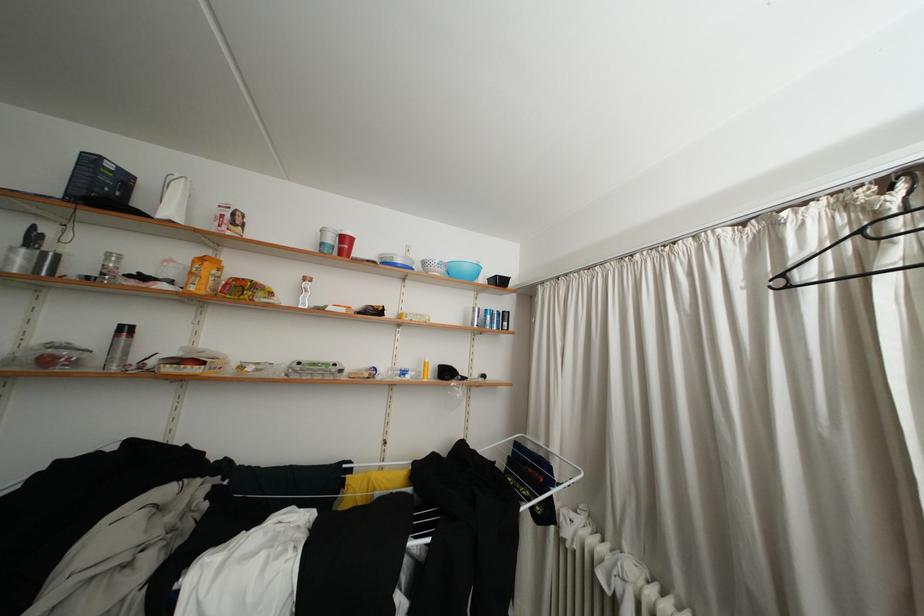
Where would you lift the white laundry basket? Please return your answer as a coordinate pair (x, y).

(535, 464)